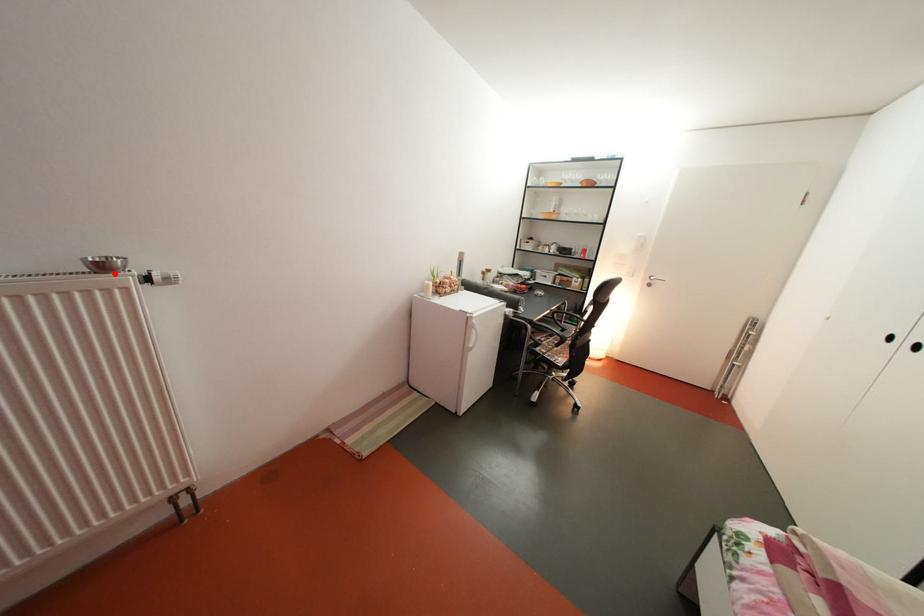
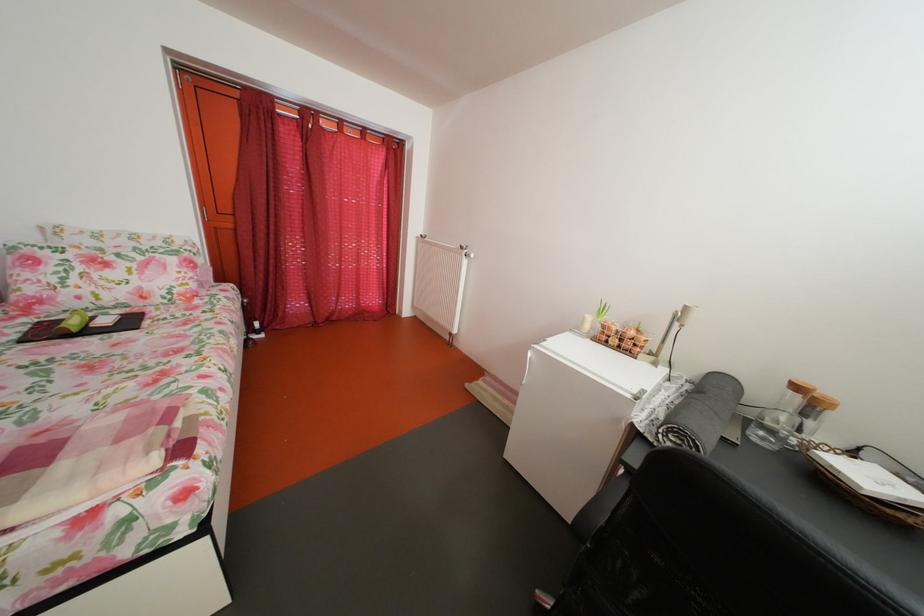
Question: I am providing you with two images of the same scene from different viewpoints. A red point is shown in image1. For the corresponding object point in image2, is it positioned nearer or farther from the camera?

Choices:
 (A) Nearer
 (B) Farther

Answer: (A)